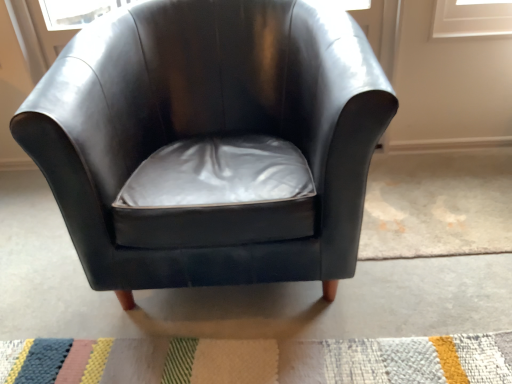
Where is `vacant space in multicolored woven mat at lower center (from a real-world perspective)`? This screenshot has height=384, width=512. vacant space in multicolored woven mat at lower center (from a real-world perspective) is located at coordinates (310, 352).